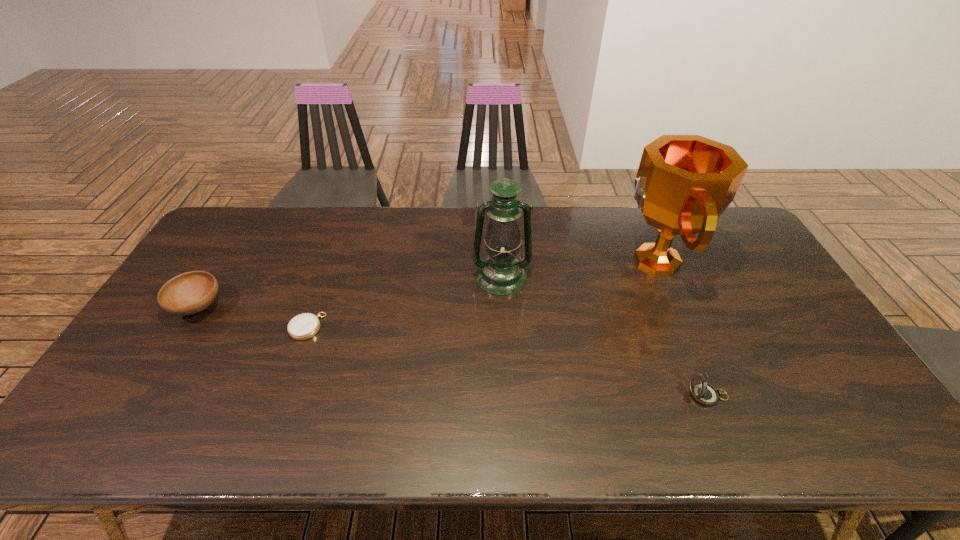
This screenshot has width=960, height=540. Identify the location of free spot between the award and the third object from left to right. (579, 268).

Identify which object is the second closest to the leftmost object. Please provide its 2D coordinates. Your answer should be formatted as a tuple, i.e. [(x, y)], where the tuple contains the x and y coordinates of a point satisfying the conditions above.

[(501, 273)]

The image size is (960, 540). Find the location of `object that is the third closest to the oil lamp`. object that is the third closest to the oil lamp is located at coordinates (x=704, y=393).